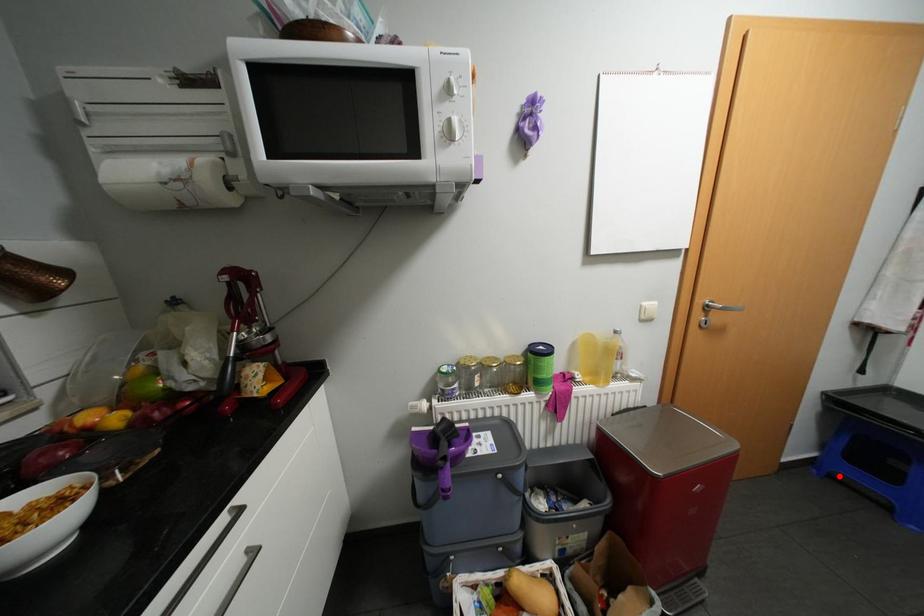
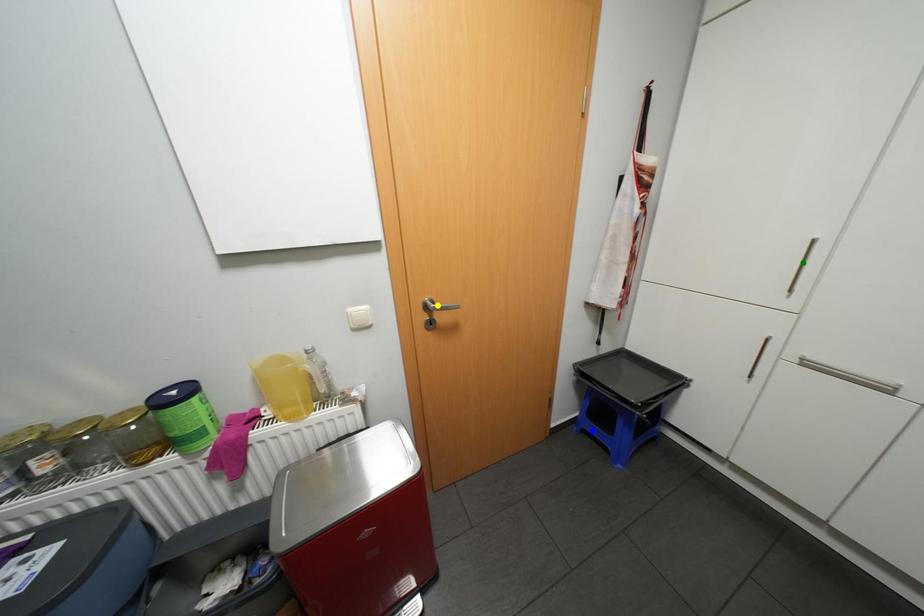
Question: I am providing you with two images of the same scene from different viewpoints. A red point is marked on the first image. You are given multiple points on the second image. Can you choose the point in image 2 that corresponds to the point in image 1?

Choices:
 (A) green point
 (B) blue point
 (C) yellow point

Answer: (B)